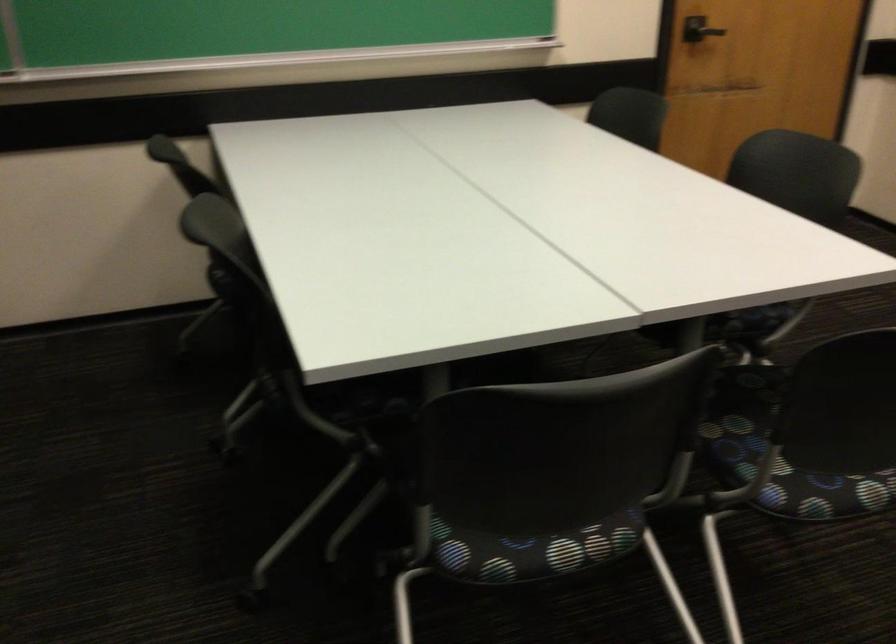
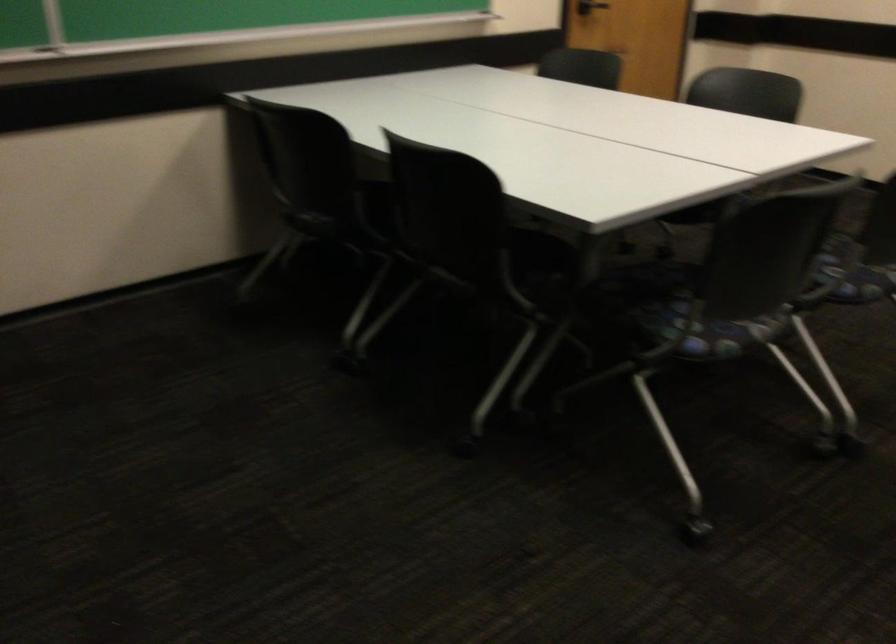
In the second image, find the point that corresponds to point 752,480 in the first image.

(853, 272)